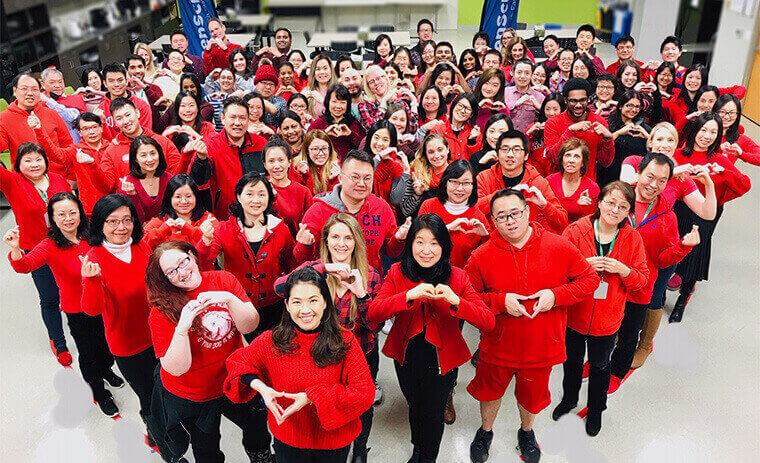
The image size is (760, 463). I want to click on red marking tape on floor, so click(114, 418), click(68, 367), click(583, 410), click(629, 371).